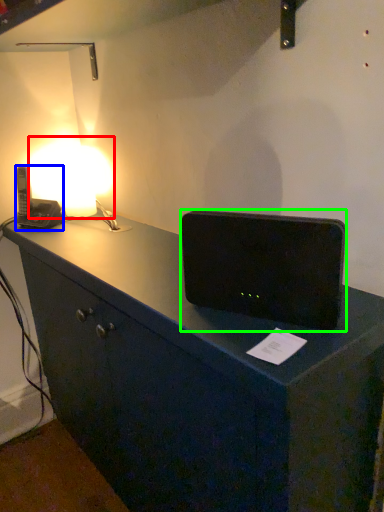
Question: Which is farther away from lamp (highlighted by a red box)? gadget (highlighted by a blue box) or loudspeaker (highlighted by a green box)?

Choices:
 (A) gadget
 (B) loudspeaker

Answer: (B)